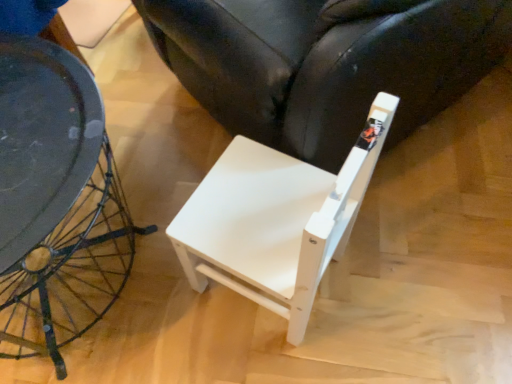
Question: Is the depth of white matte chair at lower right, the first chair when ordered from top to bottom, greater than that of white matte chair at center, the second chair viewed from the top?

Choices:
 (A) yes
 (B) no

Answer: (A)

Question: From the image's perspective, would you say white matte chair at lower right, the first chair when ordered from top to bottom, is positioned over white matte chair at center, the second chair viewed from the top?

Choices:
 (A) no
 (B) yes

Answer: (B)

Question: Is white matte chair at center, the second chair viewed from the top, at the back of white matte chair at lower right, arranged as the 2th chair when ordered from the bottom?

Choices:
 (A) no
 (B) yes

Answer: (A)

Question: Can you confirm if white matte chair at lower right, the first chair when ordered from top to bottom, is bigger than white matte chair at center, the second chair viewed from the top?

Choices:
 (A) yes
 (B) no

Answer: (A)

Question: Is white matte chair at lower right, the first chair when ordered from top to bottom, closer to camera compared to white matte chair at center, the 1th chair from the bottom?

Choices:
 (A) yes
 (B) no

Answer: (B)

Question: Does white matte chair at lower right, the first chair when ordered from top to bottom, have a greater height compared to white matte chair at center, the second chair viewed from the top?

Choices:
 (A) yes
 (B) no

Answer: (A)

Question: Does white matte chair at center, the second chair viewed from the top, have a larger size compared to white matte chair at lower right, arranged as the 2th chair when ordered from the bottom?

Choices:
 (A) yes
 (B) no

Answer: (B)

Question: Can you confirm if white matte chair at center, the 1th chair from the bottom, is shorter than white matte chair at lower right, arranged as the 2th chair when ordered from the bottom?

Choices:
 (A) yes
 (B) no

Answer: (A)

Question: From a real-world perspective, is white matte chair at center, the second chair viewed from the top, on white matte chair at lower right, arranged as the 2th chair when ordered from the bottom?

Choices:
 (A) yes
 (B) no

Answer: (B)

Question: Is white matte chair at center, the 1th chair from the bottom, smaller than white matte chair at lower right, arranged as the 2th chair when ordered from the bottom?

Choices:
 (A) yes
 (B) no

Answer: (A)

Question: Is white matte chair at center, the second chair viewed from the top, not within white matte chair at lower right, the first chair when ordered from top to bottom?

Choices:
 (A) no
 (B) yes

Answer: (B)

Question: Is white matte chair at center, the second chair viewed from the top, surrounding white matte chair at lower right, arranged as the 2th chair when ordered from the bottom?

Choices:
 (A) yes
 (B) no

Answer: (B)

Question: Relative to white matte chair at lower right, arranged as the 2th chair when ordered from the bottom, is white matte chair at center, the 1th chair from the bottom, in front or behind?

Choices:
 (A) behind
 (B) front

Answer: (B)